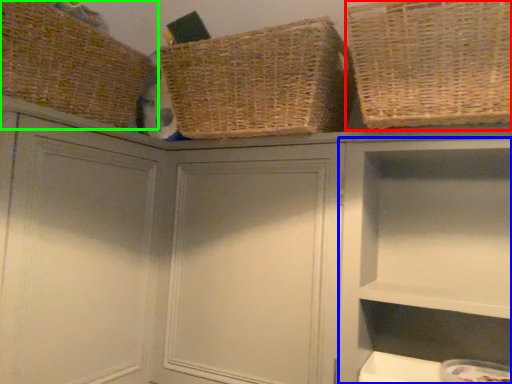
Question: Which object is the farthest from basket (highlighted by a red box)? Choose among these: cabinet (highlighted by a blue box) or basket (highlighted by a green box).

Choices:
 (A) cabinet
 (B) basket

Answer: (B)